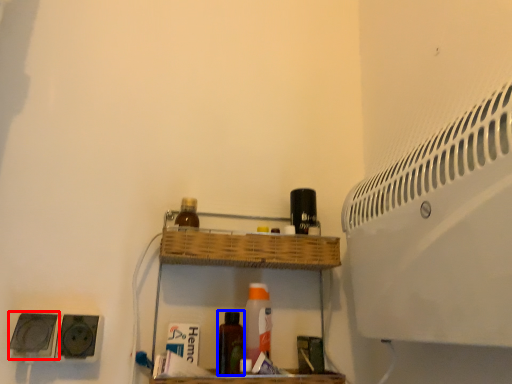
Question: Which object is closer to the camera taking this photo, speaker (highlighted by a red box) or bottle (highlighted by a blue box)?

Choices:
 (A) speaker
 (B) bottle

Answer: (A)